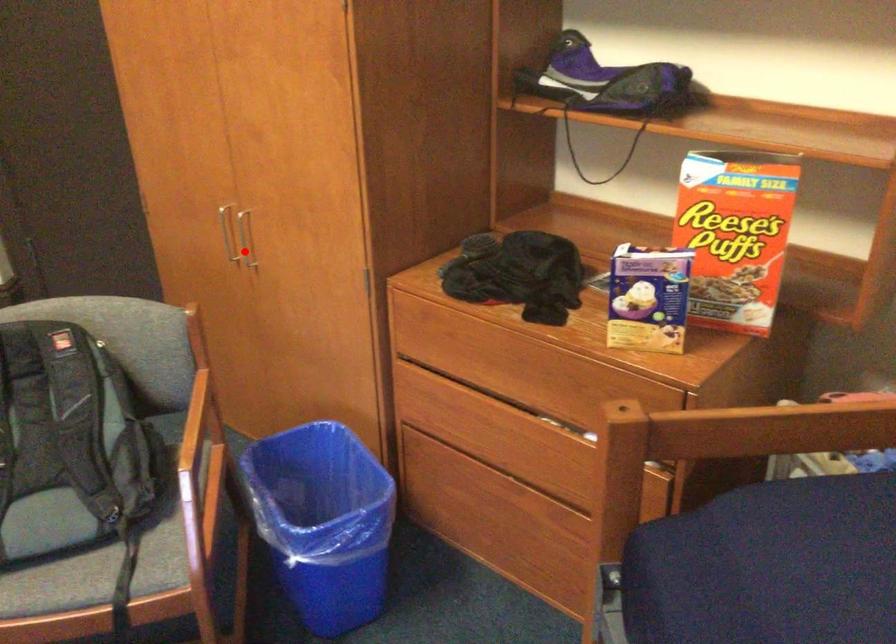
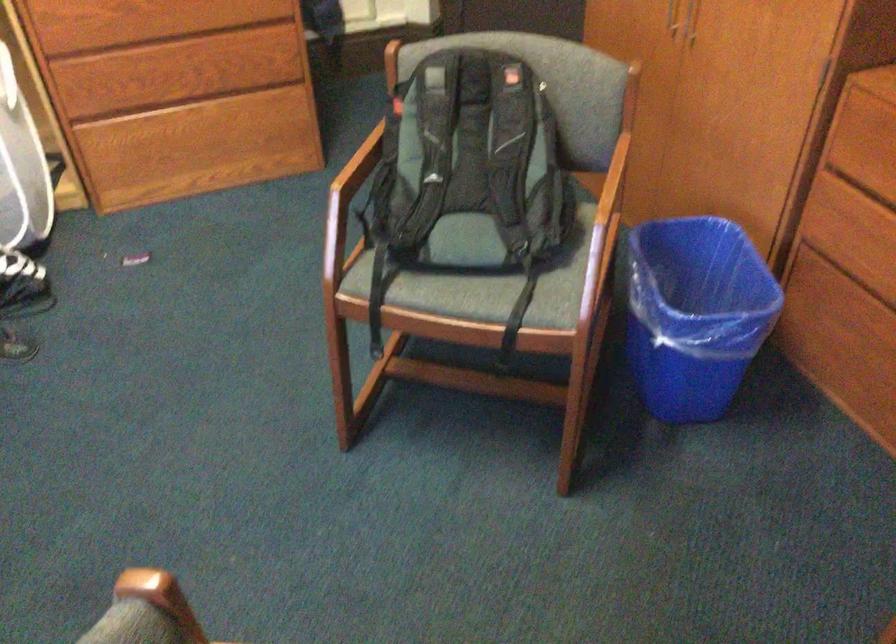
The point at the highlighted location is marked in the first image. Where is the corresponding point in the second image?

(691, 21)